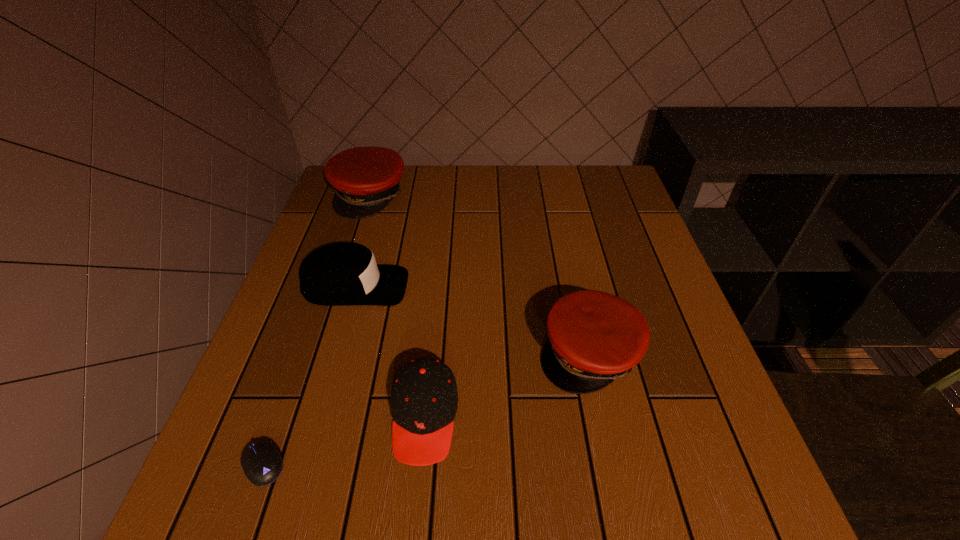
At what (x,y) coordinates should I click in order to perform the action: click on object at the far edge. Please return your answer as a coordinate pair (x, y). The width and height of the screenshot is (960, 540). Looking at the image, I should click on (365, 179).

Where is `object that is at the near edge`? The image size is (960, 540). object that is at the near edge is located at coordinates (262, 464).

Locate an element on the screen. The height and width of the screenshot is (540, 960). computer mouse at the left edge is located at coordinates (262, 464).

Locate an element on the screen. Image resolution: width=960 pixels, height=540 pixels. object that is at the right edge is located at coordinates (595, 337).

Find the location of a particular element. The image size is (960, 540). object that is at the far left corner is located at coordinates (365, 179).

The height and width of the screenshot is (540, 960). Find the location of `object situated at the near left corner`. object situated at the near left corner is located at coordinates (262, 464).

This screenshot has height=540, width=960. In the image, there is a desktop. In order to click on free space at the far edge in this screenshot , I will do `click(475, 174)`.

The height and width of the screenshot is (540, 960). I want to click on vacant space at the near edge of the desktop, so click(603, 505).

The width and height of the screenshot is (960, 540). I want to click on free space at the left edge of the desktop, so click(352, 311).

Where is `vacant space at the right edge of the desktop`? The height and width of the screenshot is (540, 960). vacant space at the right edge of the desktop is located at coordinates (646, 305).